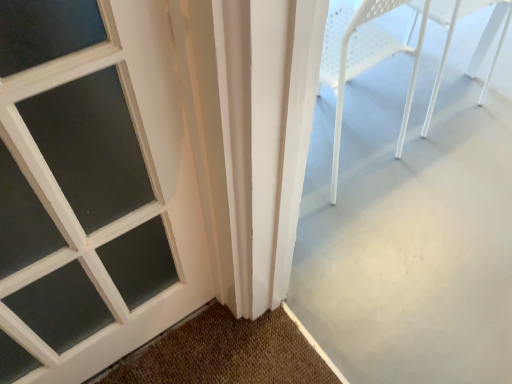
What are the coordinates of `free space in front of white plastic chair at right` in the screenshot? It's located at (438, 158).